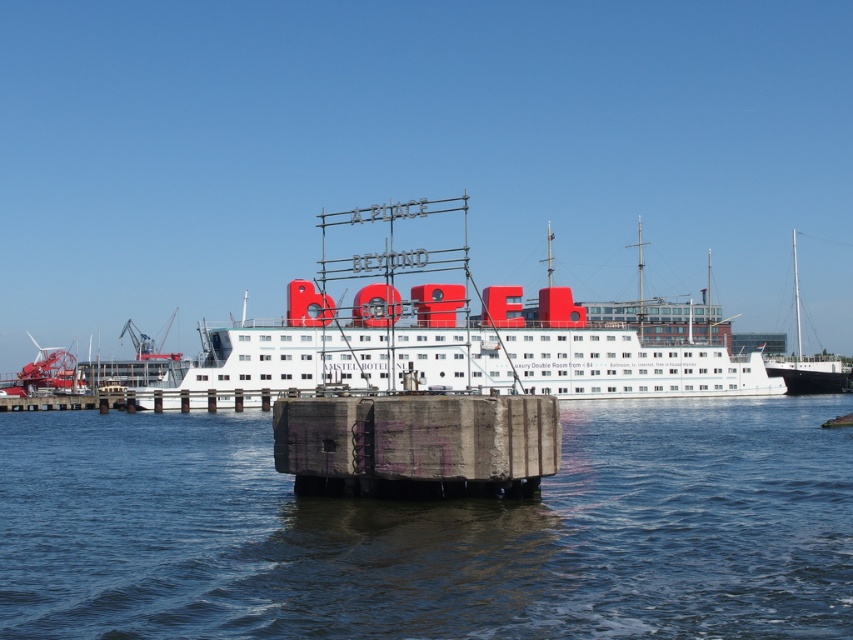
Is point (448, 284) positioned before point (341, 420)?

No, (448, 284) is behind (341, 420).

Between point (390, 371) and point (341, 426), which one is positioned behind?

The point (390, 371) is more distant.

Who is more forward, [354,369] or [432,400]?

Point [432,400]

This screenshot has width=853, height=640. Find the location of `white matte boat at center`. white matte boat at center is located at coordinates (456, 336).

Between point (749, 355) and point (792, 368), which one is positioned behind?

The point (792, 368) is more distant.

What do you see at coordinates (456, 336) in the screenshot? Image resolution: width=853 pixels, height=640 pixels. I see `white matte boat at center` at bounding box center [456, 336].

The width and height of the screenshot is (853, 640). Identify the location of white matte boat at center. (456, 336).

Does point (486, 460) come behind point (833, 385)?

No.

Which is behind, point (285, 429) or point (792, 246)?

Positioned behind is point (792, 246).

At what (x,y) coordinates should I click in order to perform the action: click on concrete dock at center. Please return your answer as a coordinate pair (x, y). The width and height of the screenshot is (853, 640). Looking at the image, I should click on (416, 444).